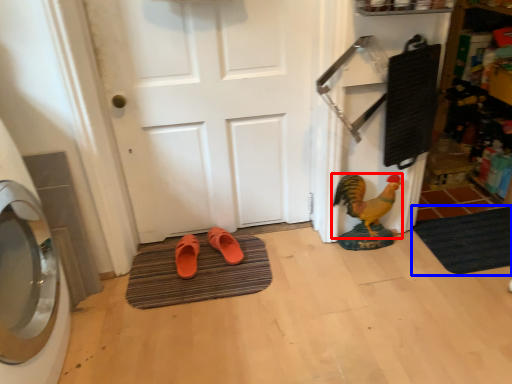
Question: Which point is further to the camera, chicken (highlighted by a red box) or bath mat (highlighted by a blue box)?

Choices:
 (A) chicken
 (B) bath mat

Answer: (B)